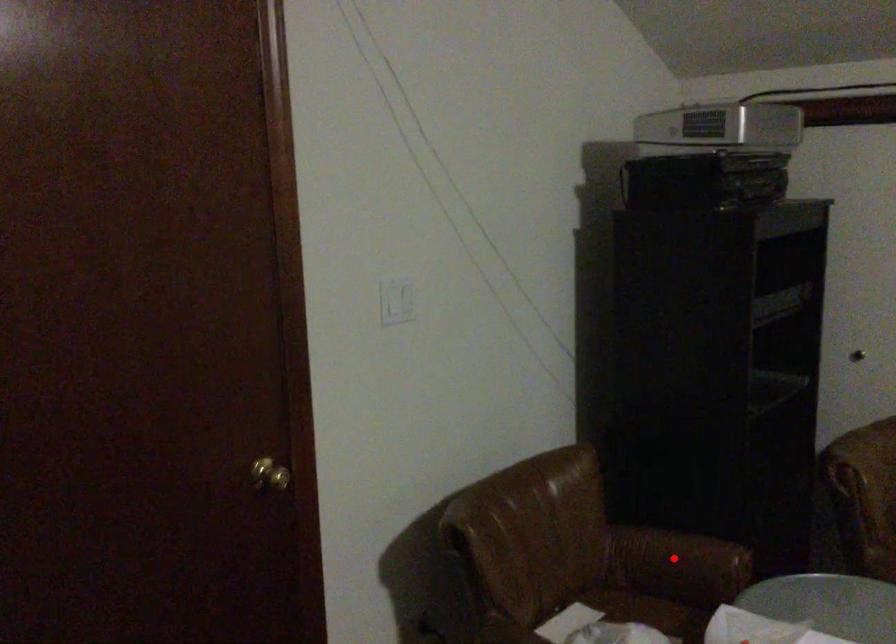
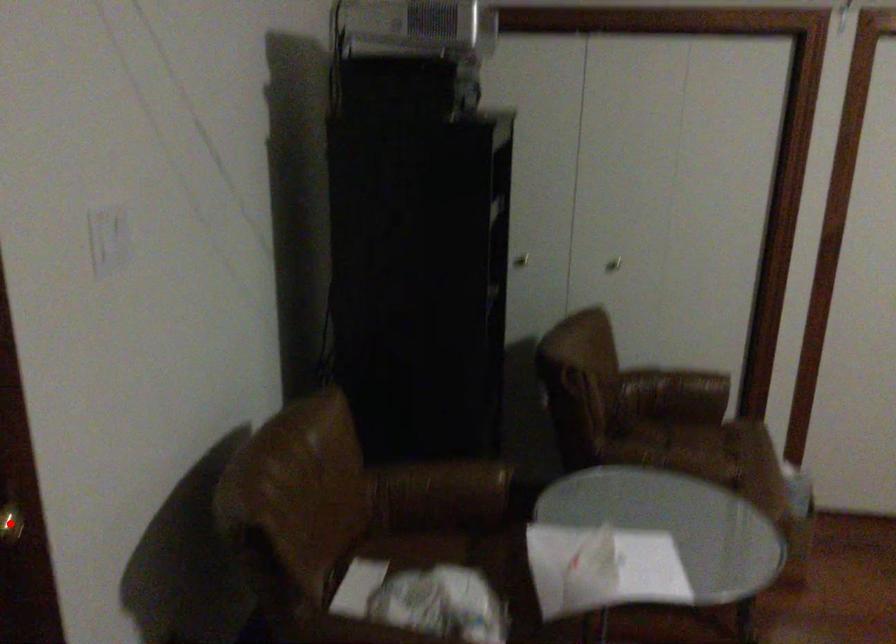
I am providing you with two images of the same scene from different viewpoints. A red point is marked on the first image and another point is marked on the second image. Are the points marked in image1 and image2 representing the same 3D position?

No